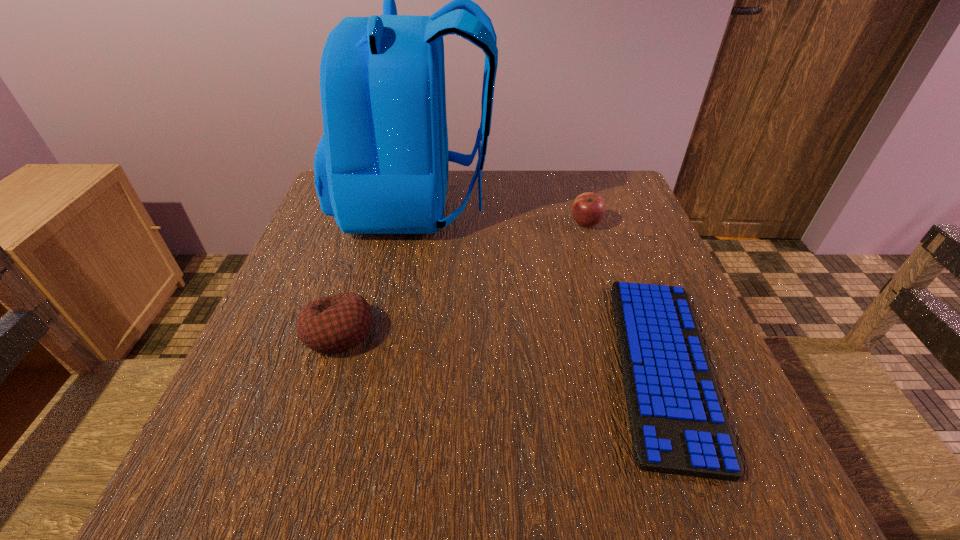
Identify the location of object that is at the near edge. The image size is (960, 540). (678, 423).

Locate an element on the screen. Image resolution: width=960 pixels, height=540 pixels. backpack positioned at the left edge is located at coordinates [x=381, y=167].

The image size is (960, 540). Identify the location of beanbag that is positioned at the left edge. (339, 322).

Where is `apple that is at the right edge`? This screenshot has width=960, height=540. apple that is at the right edge is located at coordinates (588, 209).

You are a GUI agent. You are given a task and a screenshot of the screen. Output one action in this format:
    pyautogui.click(x=<x>, y=<y>)
    Task: Click on the computer keyboard that is positioned at the right edge
    This screenshot has height=540, width=960.
    Given the screenshot: What is the action you would take?
    pyautogui.click(x=678, y=423)

The height and width of the screenshot is (540, 960). I want to click on object that is at the far left corner, so click(x=381, y=167).

You are a GUI agent. You are given a task and a screenshot of the screen. Output one action in this format:
    pyautogui.click(x=<x>, y=<y>)
    Task: Click on the object at the far right corner
    This screenshot has height=540, width=960.
    Given the screenshot: What is the action you would take?
    pyautogui.click(x=588, y=209)

Image resolution: width=960 pixels, height=540 pixels. In order to click on object that is at the near right corner in this screenshot , I will do `click(678, 423)`.

Find the location of a particular element. vacant area at the far edge is located at coordinates (516, 214).

I want to click on free region at the left edge of the desktop, so click(268, 443).